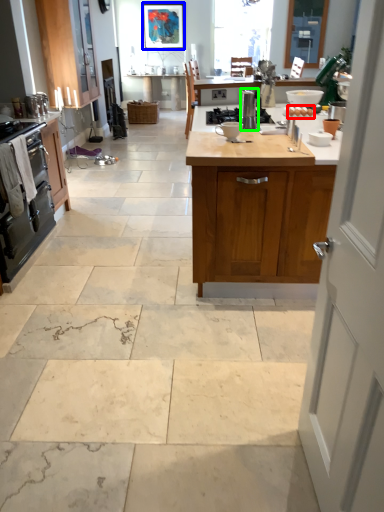
Question: Considering the real-world distances, which object is closest to food (highlighted by a red box)? picture frame (highlighted by a blue box) or appliance (highlighted by a green box).

Choices:
 (A) picture frame
 (B) appliance

Answer: (B)